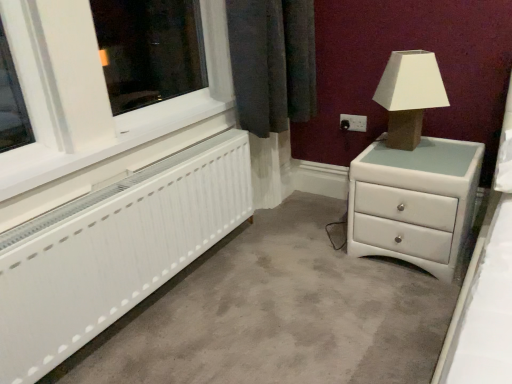
Image resolution: width=512 pixels, height=384 pixels. I want to click on free spot above white plastic window frame at left (from a real-world perspective), so click(x=123, y=126).